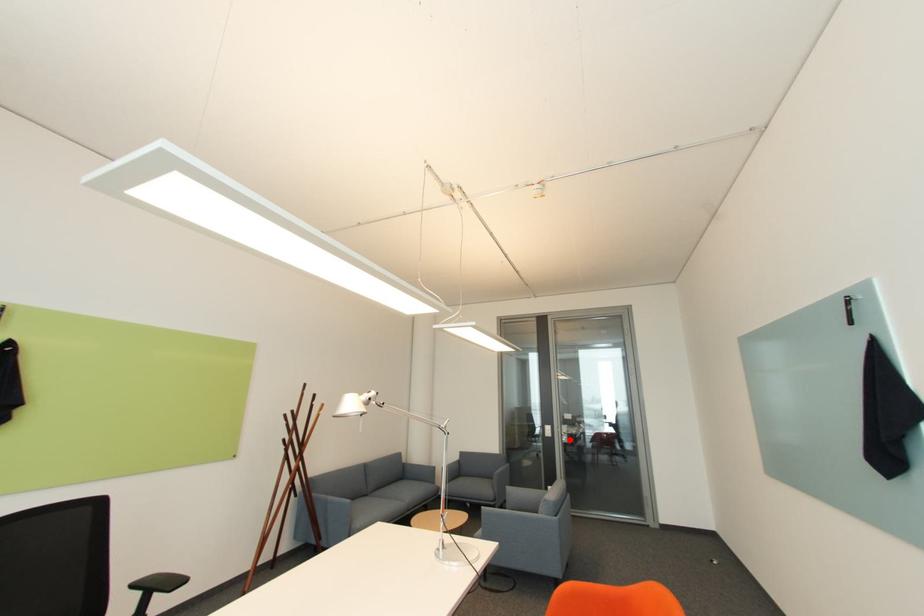
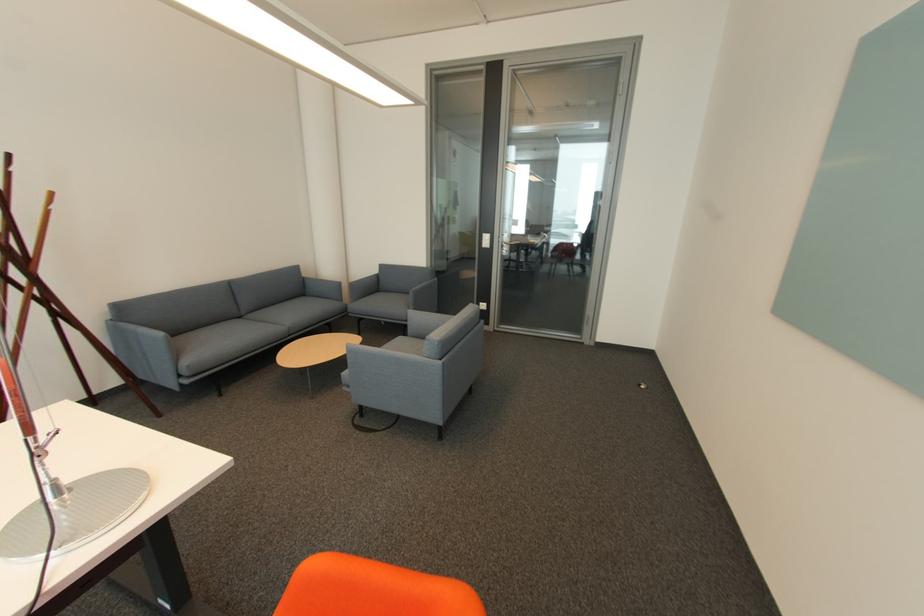
Question: I am providing you with two images of the same scene from different viewpoints. Image1 has a red point marked. In image2, the corresponding 3D location appears at what relative position? Reply with the corresponding letter.

Choices:
 (A) Closer
 (B) Farther

Answer: (A)